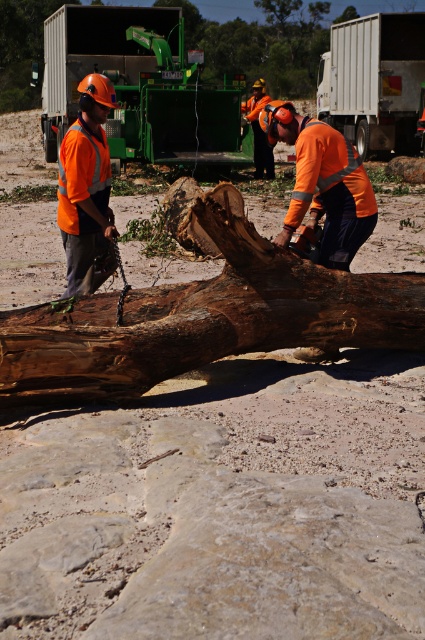
Which of these two, brown rough wood at center or green metallic trailer truck at upper center, stands shorter?

With less height is brown rough wood at center.

Who is more forward, (210, 192) or (125, 122)?

Point (210, 192)

The image size is (425, 640). What are the coordinates of `brown rough wood at center` in the screenshot? It's located at point(203,317).

This screenshot has width=425, height=640. What are the coordinates of `brown rough wood at center` in the screenshot? It's located at (203, 317).

Describe the element at coordinates (203, 317) in the screenshot. I see `brown rough wood at center` at that location.

Does brown rough wood at center appear on the left side of high visibility orange safety vest at left?

Incorrect, brown rough wood at center is not on the left side of high visibility orange safety vest at left.

Describe the element at coordinates (203, 317) in the screenshot. I see `brown rough wood at center` at that location.

Locate an element on the screen. brown rough wood at center is located at coordinates (203, 317).

Between green metallic trailer truck at upper center and white matte trailer truck at upper center, which one is positioned lower?

green metallic trailer truck at upper center

Identify the location of green metallic trailer truck at upper center. This screenshot has height=640, width=425. (139, 86).

Is point (135, 106) positioned in front of point (342, 72)?

That is True.

The height and width of the screenshot is (640, 425). I want to click on green metallic trailer truck at upper center, so click(x=139, y=86).